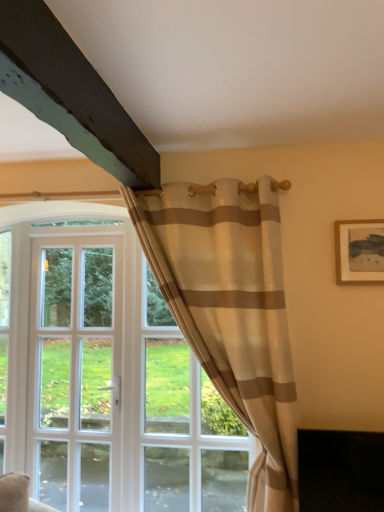
Question: From the image's perspective, is beige striped fabric at center located beneath wooden framed artwork at upper right?

Choices:
 (A) no
 (B) yes

Answer: (B)

Question: Can you confirm if beige striped fabric at center is bigger than wooden framed artwork at upper right?

Choices:
 (A) no
 (B) yes

Answer: (B)

Question: From a real-world perspective, is beige striped fabric at center located beneath wooden framed artwork at upper right?

Choices:
 (A) yes
 (B) no

Answer: (A)

Question: Is beige striped fabric at center positioned in front of wooden framed artwork at upper right?

Choices:
 (A) yes
 (B) no

Answer: (A)

Question: Can you confirm if beige striped fabric at center is wider than wooden framed artwork at upper right?

Choices:
 (A) yes
 (B) no

Answer: (A)

Question: Is beige striped fabric at center beside wooden framed artwork at upper right?

Choices:
 (A) no
 (B) yes

Answer: (A)

Question: Considering the relative positions of beige striped fabric at center and white glass door at left in the image provided, is beige striped fabric at center to the right of white glass door at left from the viewer's perspective?

Choices:
 (A) no
 (B) yes

Answer: (B)

Question: From the image's perspective, is beige striped fabric at center on white glass door at left?

Choices:
 (A) no
 (B) yes

Answer: (B)

Question: Is beige striped fabric at center bigger than white glass door at left?

Choices:
 (A) yes
 (B) no

Answer: (A)

Question: Is beige striped fabric at center facing away from white glass door at left?

Choices:
 (A) no
 (B) yes

Answer: (A)

Question: Are beige striped fabric at center and white glass door at left located far from each other?

Choices:
 (A) yes
 (B) no

Answer: (A)

Question: Considering the relative sizes of beige striped fabric at center and white glass door at left in the image provided, is beige striped fabric at center shorter than white glass door at left?

Choices:
 (A) no
 (B) yes

Answer: (B)

Question: From a real-world perspective, is wooden framed artwork at upper right over white glass door at left?

Choices:
 (A) no
 (B) yes

Answer: (B)